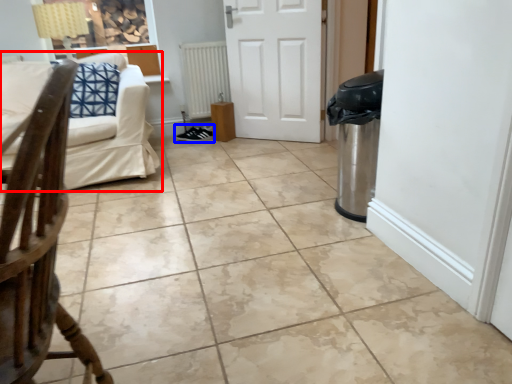
Question: Which of the following is the closest to the observer, studio couch (highlighted by a red box) or footwear (highlighted by a blue box)?

Choices:
 (A) studio couch
 (B) footwear

Answer: (A)